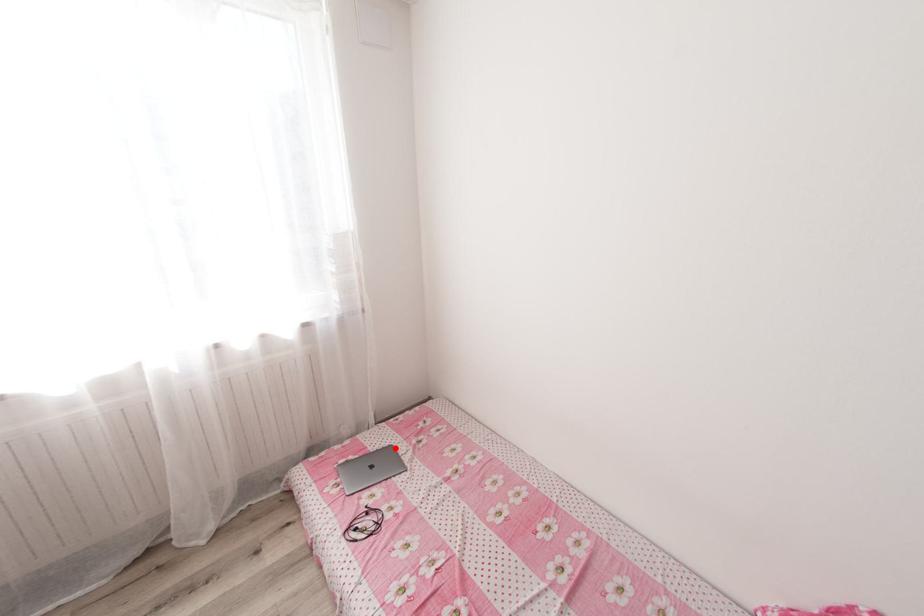
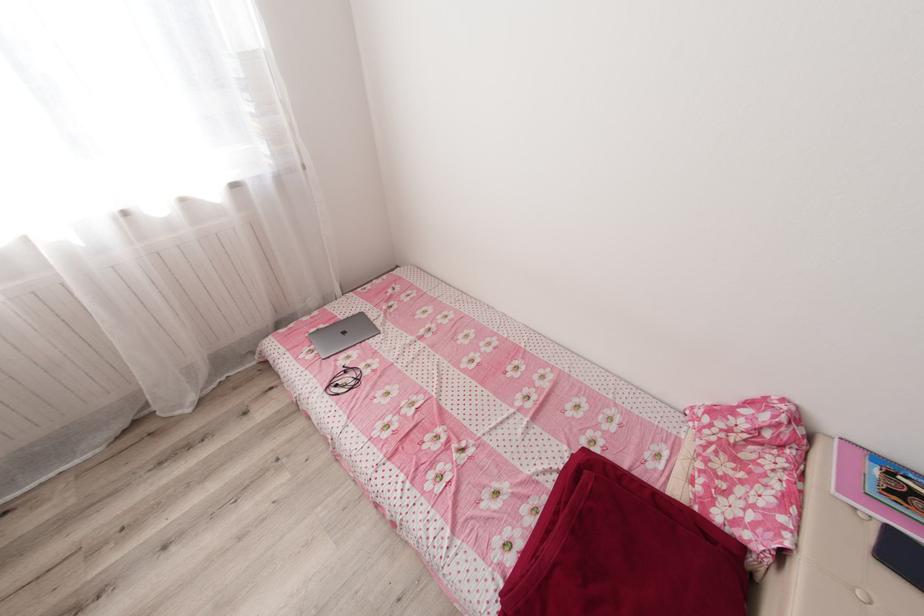
Find the pixel in the second image that matches the highlighted location in the first image.

(367, 315)